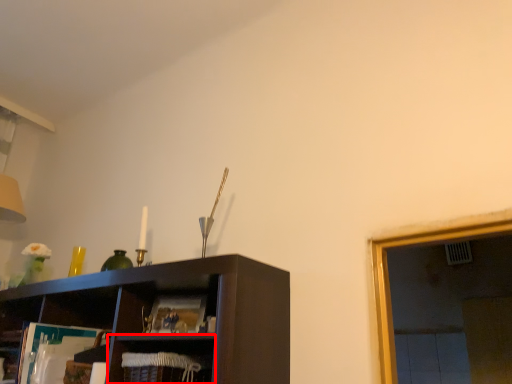
Question: From the image's perspective, what is the correct spatial relationship of cabinet (annotated by the red box) in relation to magazine?

Choices:
 (A) below
 (B) above

Answer: (A)